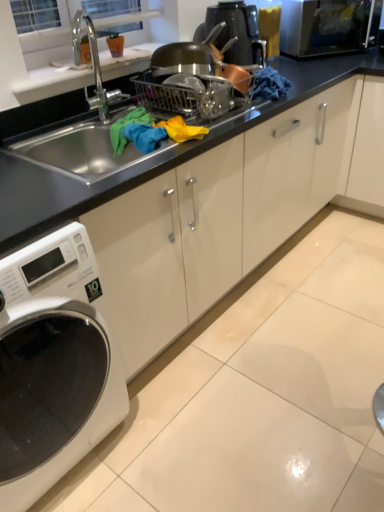
Question: Would you say white glossy washing machine at lower left is a long distance from black matte sink at center?

Choices:
 (A) yes
 (B) no

Answer: (B)

Question: Considering the relative sizes of white glossy washing machine at lower left and black matte sink at center in the image provided, is white glossy washing machine at lower left shorter than black matte sink at center?

Choices:
 (A) no
 (B) yes

Answer: (A)

Question: Considering the relative sizes of white glossy washing machine at lower left and black matte sink at center in the image provided, is white glossy washing machine at lower left wider than black matte sink at center?

Choices:
 (A) no
 (B) yes

Answer: (B)

Question: From a real-world perspective, is white glossy washing machine at lower left positioned over black matte sink at center based on gravity?

Choices:
 (A) yes
 (B) no

Answer: (B)

Question: Is white glossy washing machine at lower left positioned behind black matte sink at center?

Choices:
 (A) no
 (B) yes

Answer: (A)

Question: From a real-world perspective, relative to black glass microwave at upper right, is white glossy washing machine at lower left vertically above or below?

Choices:
 (A) above
 (B) below

Answer: (B)

Question: Is white glossy washing machine at lower left to the left or to the right of black glass microwave at upper right in the image?

Choices:
 (A) right
 (B) left

Answer: (B)

Question: From the image's perspective, relative to black glass microwave at upper right, is white glossy washing machine at lower left above or below?

Choices:
 (A) above
 (B) below

Answer: (B)

Question: Is white glossy washing machine at lower left bigger or smaller than black glass microwave at upper right?

Choices:
 (A) big
 (B) small

Answer: (A)

Question: Considering the relative positions of black glossy coffee machine at upper center and black matte sink at center in the image provided, is black glossy coffee machine at upper center to the left or to the right of black matte sink at center?

Choices:
 (A) right
 (B) left

Answer: (A)

Question: In terms of size, does black glossy coffee machine at upper center appear bigger or smaller than black matte sink at center?

Choices:
 (A) big
 (B) small

Answer: (B)

Question: Considering the positions of black glossy coffee machine at upper center and black matte sink at center in the image, is black glossy coffee machine at upper center taller or shorter than black matte sink at center?

Choices:
 (A) tall
 (B) short

Answer: (B)

Question: Is black glossy coffee machine at upper center in front of or behind black matte sink at center in the image?

Choices:
 (A) front
 (B) behind

Answer: (B)

Question: Visually, is black glass microwave at upper right positioned to the left or to the right of black glossy coffee machine at upper center?

Choices:
 (A) right
 (B) left

Answer: (A)

Question: From the image's perspective, is black glass microwave at upper right located above or below black glossy coffee machine at upper center?

Choices:
 (A) below
 (B) above

Answer: (B)